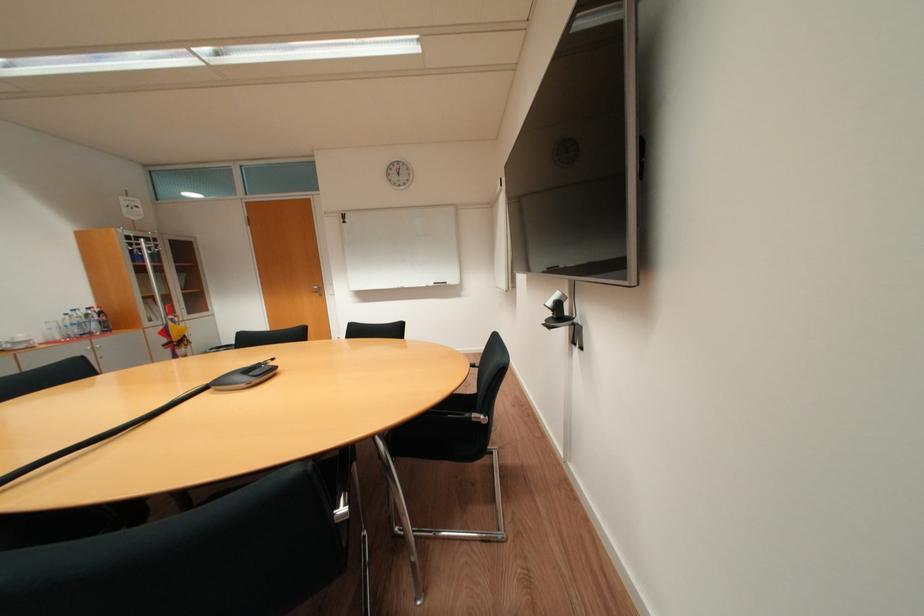
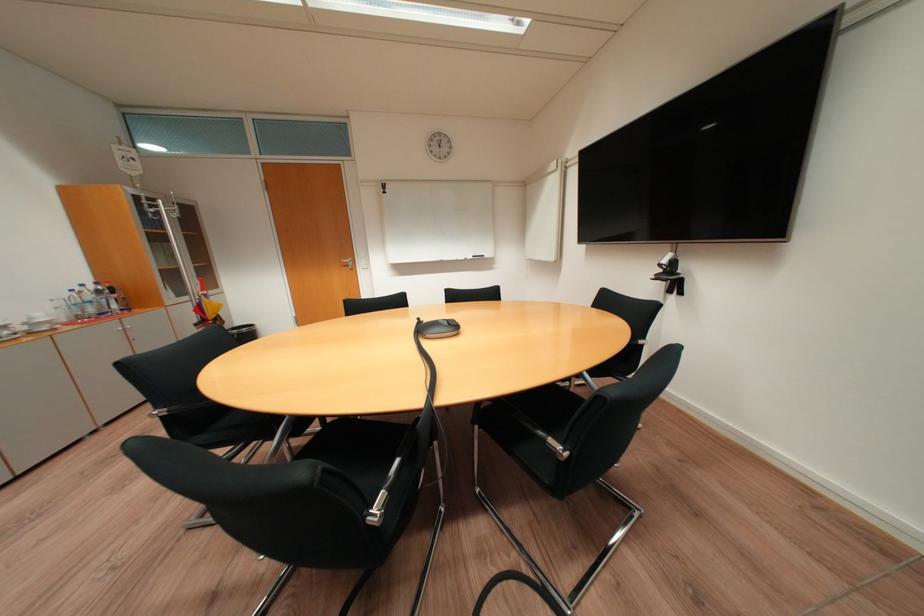
Where in the second image is the point corresponding to point 558,304 from the first image?

(673, 262)